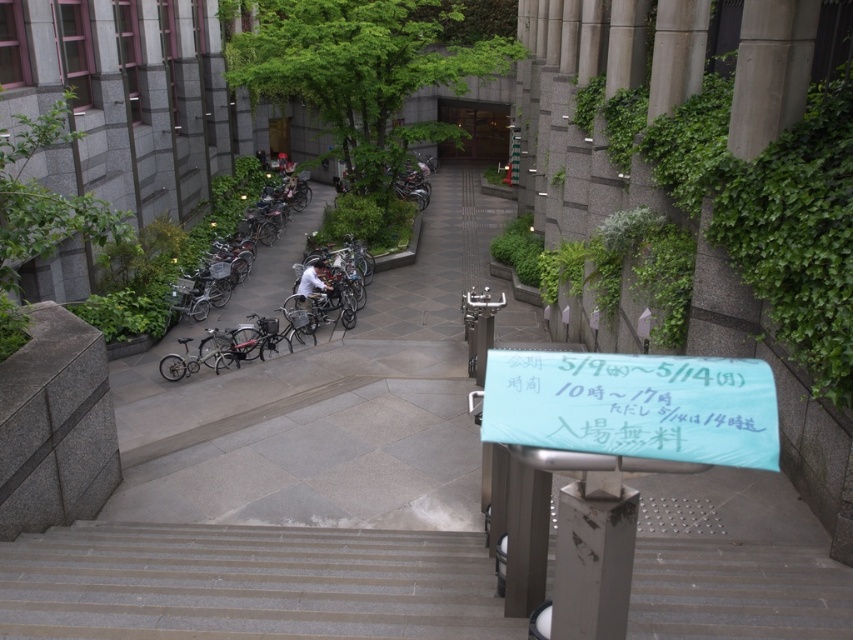
Question: Is gray concrete stairs at lower center positioned in front of matte black bicycle at center?

Choices:
 (A) no
 (B) yes

Answer: (B)

Question: Which point is farther from the camera taking this photo?

Choices:
 (A) (724, 448)
 (B) (309, 289)
 (C) (347, 444)
 (D) (51, 621)

Answer: (B)

Question: Which of the following is the closest to the observer?

Choices:
 (A) [x=451, y=628]
 (B) [x=395, y=612]

Answer: (A)

Question: Does gray concrete stairs at lower center have a greater width compared to teal fabric banner at center?

Choices:
 (A) no
 (B) yes

Answer: (B)

Question: Does teal fabric banner at center have a larger size compared to matte black bicycle at center?

Choices:
 (A) no
 (B) yes

Answer: (A)

Question: Among these points, which one is nearest to the camera?

Choices:
 (A) (683, 504)
 (B) (515, 444)

Answer: (B)